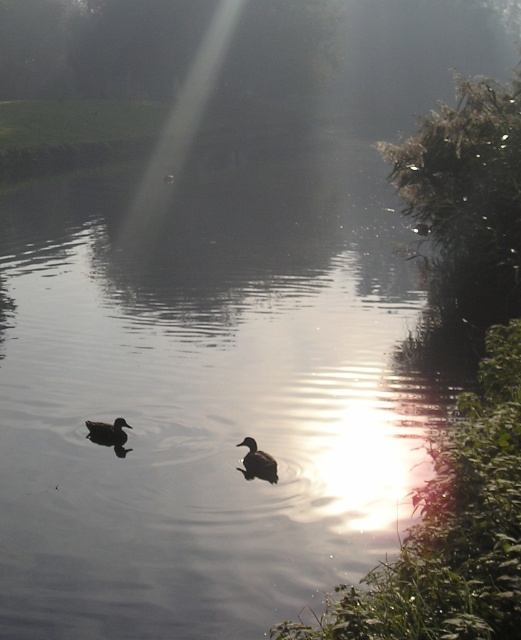
You are standing at the edge of the water and want to reach the smooth dark water at center. What direction should you move in to get there?

The smooth dark water at center is located at point coordinates of [205,394]. To reach it from the edge, you would need to move towards the center of the water body.

You are a photographer aiming to capture the reflection of the brown matte duck at center in the smooth dark water at center. Based on the scene description, will the duck be fully visible in the water reflection?

The smooth dark water at center is wider than the brown matte duck at center, so the duck will be fully visible in the water reflection since the water is wider than the duck.